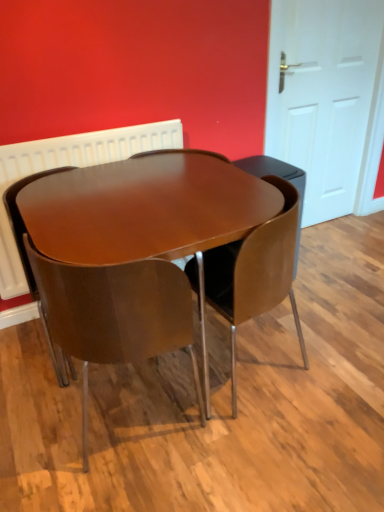
Question: Could white glossy door at right be considered to be inside glossy wood table at center?

Choices:
 (A) yes
 (B) no

Answer: (B)

Question: Considering the relative sizes of glossy wood table at center and white glossy door at right in the image provided, is glossy wood table at center thinner than white glossy door at right?

Choices:
 (A) no
 (B) yes

Answer: (A)

Question: Can you confirm if glossy wood table at center is shorter than white glossy door at right?

Choices:
 (A) yes
 (B) no

Answer: (A)

Question: Would you say glossy wood table at center is a long distance from white glossy door at right?

Choices:
 (A) no
 (B) yes

Answer: (B)

Question: Is glossy wood table at center bigger than white glossy door at right?

Choices:
 (A) no
 (B) yes

Answer: (B)

Question: Looking at the image, does brown leather chair at center, which is the 3th chair from left to right, seem bigger or smaller compared to glossy wood chair at center, which is counted as the third chair, starting from the right?

Choices:
 (A) small
 (B) big

Answer: (B)

Question: Considering the positions of brown leather chair at center, which is counted as the first chair, starting from the right, and glossy wood chair at center, the first chair in the left-to-right sequence, in the image, is brown leather chair at center, which is counted as the first chair, starting from the right, wider or thinner than glossy wood chair at center, the first chair in the left-to-right sequence,?

Choices:
 (A) thin
 (B) wide

Answer: (B)

Question: Is brown leather chair at center, which is counted as the first chair, starting from the right, to the left or to the right of glossy wood chair at center, which is counted as the third chair, starting from the right, in the image?

Choices:
 (A) right
 (B) left

Answer: (A)

Question: From a real-world perspective, relative to glossy wood chair at center, which is counted as the third chair, starting from the right, is brown leather chair at center, which is counted as the first chair, starting from the right, vertically above or below?

Choices:
 (A) above
 (B) below

Answer: (B)

Question: Is glossy wood chair at center, the first chair in the left-to-right sequence, taller or shorter than white glossy door at right?

Choices:
 (A) short
 (B) tall

Answer: (A)

Question: Considering their positions, is glossy wood chair at center, which is counted as the third chair, starting from the right, located in front of or behind white glossy door at right?

Choices:
 (A) front
 (B) behind

Answer: (A)

Question: From a real-world perspective, is glossy wood chair at center, which is counted as the third chair, starting from the right, positioned above or below white glossy door at right?

Choices:
 (A) above
 (B) below

Answer: (B)

Question: Based on their sizes in the image, would you say glossy wood chair at center, which is counted as the third chair, starting from the right, is bigger or smaller than white glossy door at right?

Choices:
 (A) small
 (B) big

Answer: (B)

Question: Is glossy wood chair at center, the first chair in the left-to-right sequence, spatially inside matte brown chair at center, acting as the 2th chair starting from the left, or outside of it?

Choices:
 (A) inside
 (B) outside

Answer: (B)

Question: From a real-world perspective, is glossy wood chair at center, the first chair in the left-to-right sequence, physically located above or below matte brown chair at center, acting as the 2th chair starting from the left?

Choices:
 (A) below
 (B) above

Answer: (B)